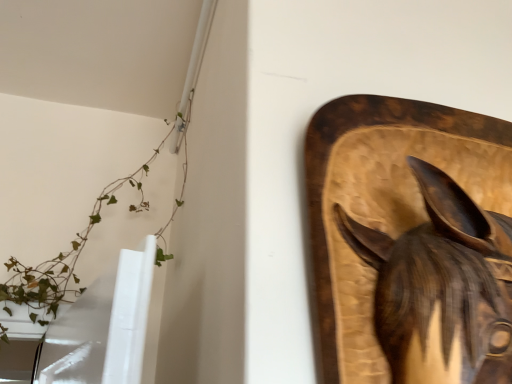
Where is `wooden horse head at upper right`? wooden horse head at upper right is located at coordinates (442, 287).

What do you see at coordinates (442, 287) in the screenshot? This screenshot has width=512, height=384. I see `wooden horse head at upper right` at bounding box center [442, 287].

Consider the image. What is the approximate height of wooden horse head at upper right?

It is 12.55 inches.

Where is `wooden horse head at upper right`? The width and height of the screenshot is (512, 384). wooden horse head at upper right is located at coordinates (442, 287).